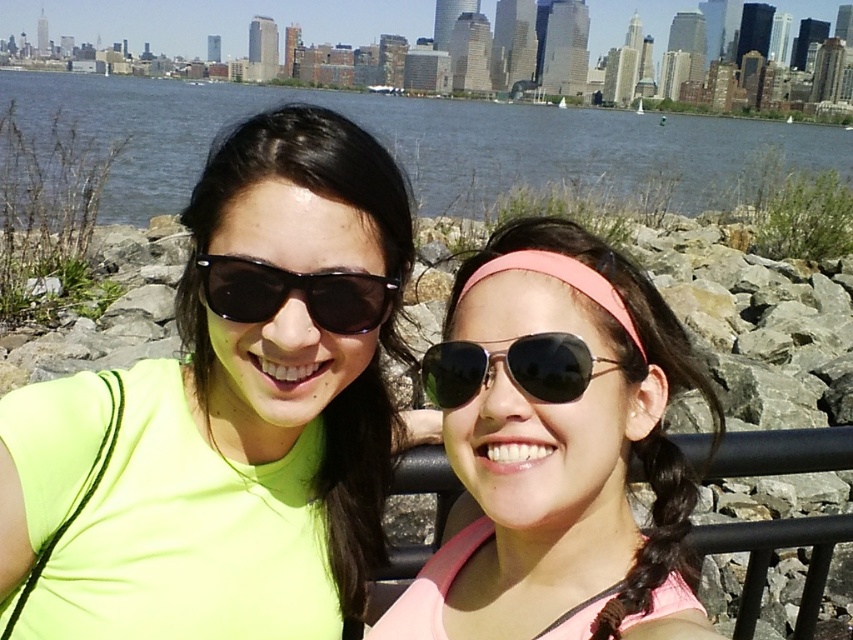
Who is higher up, pink matte headband at center or metallic aviator sunglasses at center?

Positioned higher is metallic aviator sunglasses at center.

Between pink matte headband at center and metallic aviator sunglasses at center, which one has more height?

pink matte headband at center is taller.

The image size is (853, 640). Find the location of `pink matte headband at center`. pink matte headband at center is located at coordinates tap(558, 456).

Is neon yellow fabric at center behind blue water at upper center?

No, it is not.

Who is higher up, neon yellow fabric at center or blue water at upper center?

blue water at upper center is higher up.

Does point (253, 184) lie behind point (122, 99)?

No, (253, 184) is in front of (122, 99).

Locate an element on the screen. neon yellow fabric at center is located at coordinates (228, 416).

Does neon yellow fabric at center lie behind black plastic sunglasses at center?

No, it is in front of black plastic sunglasses at center.

Find the location of a particular element. The width and height of the screenshot is (853, 640). neon yellow fabric at center is located at coordinates (228, 416).